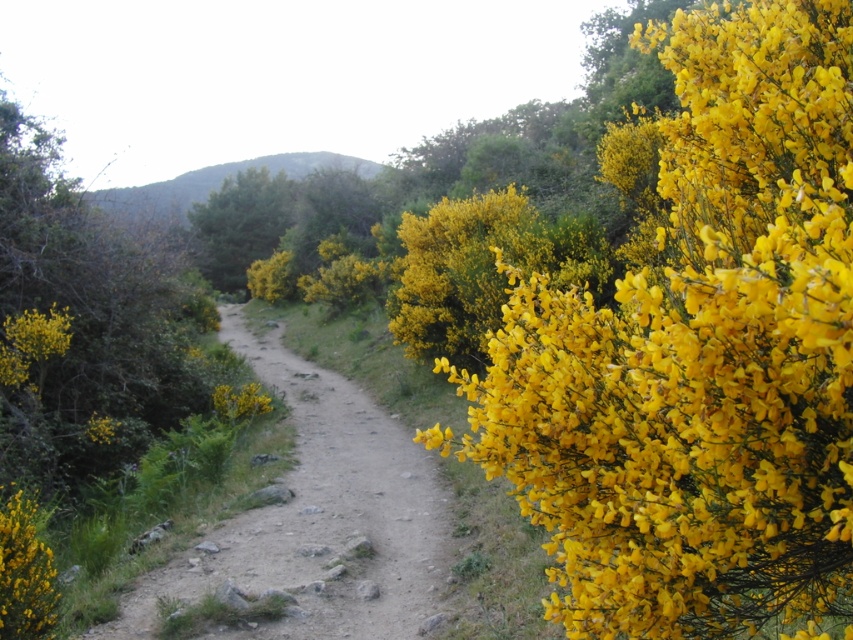
Question: Can you confirm if yellow fluffy bush at center is bigger than yellow matte bush at lower left?

Choices:
 (A) no
 (B) yes

Answer: (B)

Question: Which of the following is the closest to the observer?

Choices:
 (A) (15, 608)
 (B) (154, 600)

Answer: (A)

Question: Which of the following is the closest to the observer?

Choices:
 (A) (236, 262)
 (B) (770, 451)
 (C) (132, 212)
 (D) (0, 595)

Answer: (B)

Question: Observing the image, what is the correct spatial positioning of dusty brown dirt track at center in reference to yellow matte bush at lower left?

Choices:
 (A) above
 (B) below

Answer: (B)

Question: Which is farther from the dusty brown dirt track at center?

Choices:
 (A) yellow matte bush at lower left
 (B) yellow fluffy bush at right

Answer: (B)

Question: Does yellow fluffy bush at center have a lesser width compared to yellow matte bush at lower left?

Choices:
 (A) yes
 (B) no

Answer: (B)